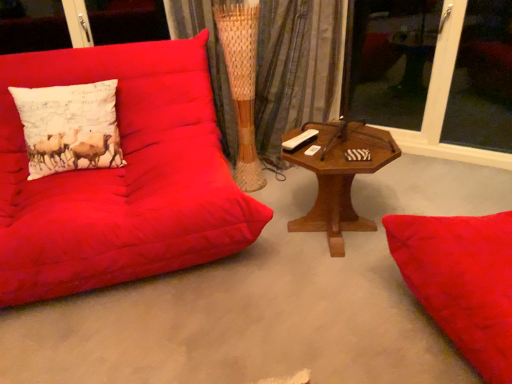
In order to click on free space in front of transparent glass window at upper right, the 2th window screen from the left in this screenshot , I will do `click(481, 175)`.